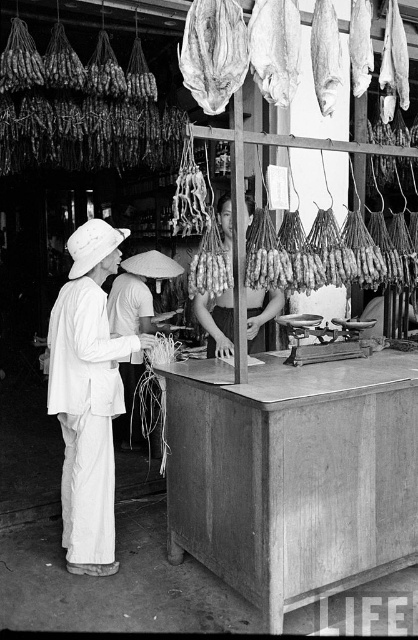
Which of these two, white cotton hat at left or dried fish at upper center, stands shorter?

dried fish at upper center

Looking at this image, is white cotton hat at left smaller than dried fish at upper center?

Incorrect, white cotton hat at left is not smaller in size than dried fish at upper center.

The height and width of the screenshot is (640, 418). I want to click on white cotton hat at left, so click(x=88, y=396).

Is white cotton hat at left closer to the viewer compared to shiny silver fish at upper center?

That is False.

Does white cotton hat at left appear on the left side of shiny silver fish at upper center?

Correct, you'll find white cotton hat at left to the left of shiny silver fish at upper center.

The image size is (418, 640). Find the location of `white cotton hat at left`. white cotton hat at left is located at coordinates (88, 396).

Who is positioned more to the right, shiny silver fish at upper center or smooth skin woman at center?

smooth skin woman at center

Is shiny silver fish at upper center above smooth skin woman at center?

Correct, shiny silver fish at upper center is located above smooth skin woman at center.

Is point (199, 68) closer to viewer compared to point (250, 307)?

That is True.

Locate an element on the screen. Image resolution: width=418 pixels, height=640 pixels. shiny silver fish at upper center is located at coordinates (214, 52).